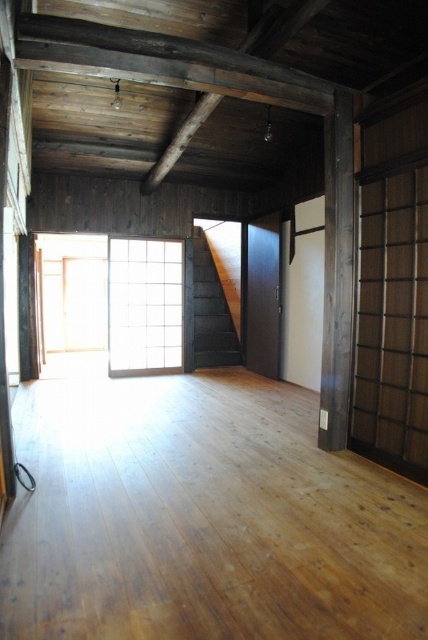
You are a delivery person bringing a long package that is 5 feet in length into the traditional Japanese room. You need to carry it through the space between the white grid screen at center and the brown wooden beam at center. Can you pass through this space without tilting the package?

The distance between the white grid screen at center and the brown wooden beam at center is 5.12 feet. Since the package is 5 feet long, it can pass through the space as the distance is slightly larger than the package length.

You are planning to hang a decorative tapestry that is 1.2 meters wide on the wall where the white grid screen at center and brown wooden beam at center are located. Based on their widths, which object should you avoid placing the tapestry next to to ensure it fits properly?

The white grid screen at center has a lesser width compared to the brown wooden beam at center. Therefore, placing the tapestry next to the brown wooden beam at center would provide more space for the tapestry to fit properly since it is wider.